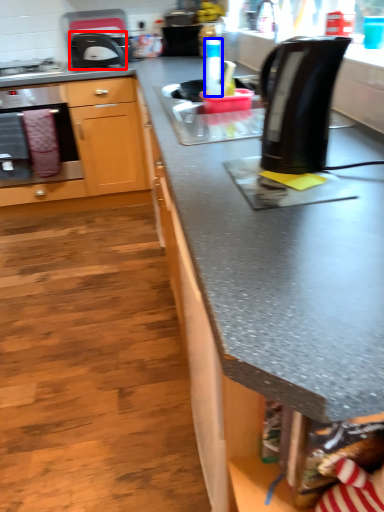
Question: Which object is further to the camera taking this photo, kitchen appliance (highlighted by a red box) or bottle (highlighted by a blue box)?

Choices:
 (A) kitchen appliance
 (B) bottle

Answer: (A)